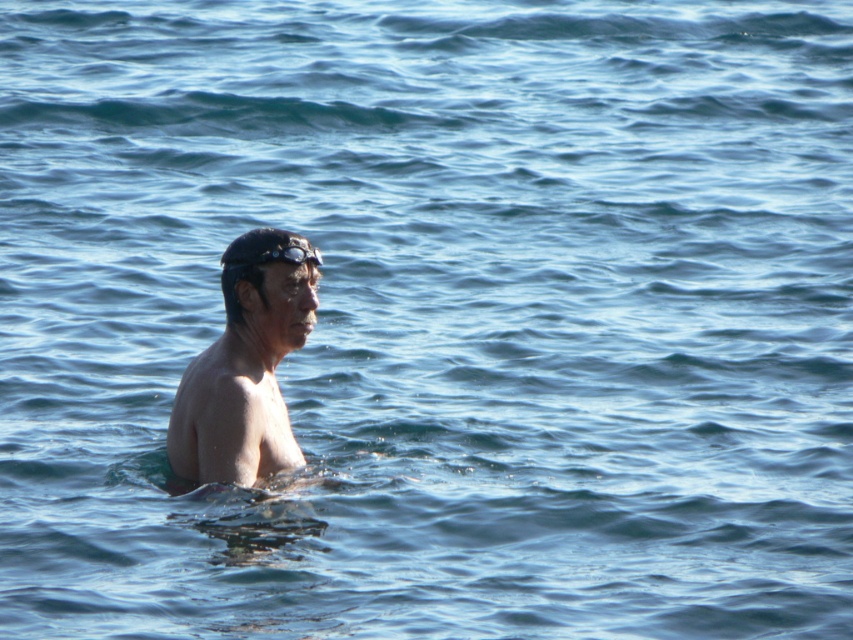
Does matte black swim cap at center have a greater height compared to black matte swim cap at center?

Yes.

Between point (212, 458) and point (294, 250), which one is positioned in front?

Point (212, 458) is more forward.

Does point (236, 336) lie in front of point (234, 275)?

No, (236, 336) is behind (234, 275).

Where is `matte black swim cap at center`? The height and width of the screenshot is (640, 853). matte black swim cap at center is located at coordinates (247, 365).

Is matte black swim cap at center above transparent rubber goggles at center?

Actually, matte black swim cap at center is below transparent rubber goggles at center.

Is point (177, 429) closer to camera compared to point (271, 250)?

No, (177, 429) is further to viewer.

This screenshot has width=853, height=640. Identify the location of matte black swim cap at center. (247, 365).

You are a GUI agent. You are given a task and a screenshot of the screen. Output one action in this format:
    pyautogui.click(x=<x>, y=<y>)
    Task: Click on the matte black swim cap at center
    
    Given the screenshot: What is the action you would take?
    pyautogui.click(x=247, y=365)

Is point (224, 305) closer to viewer compared to point (259, 260)?

That is False.

Between black matte swim cap at center and transparent rubber goggles at center, which one has less height?

transparent rubber goggles at center

Which is in front, point (292, 237) or point (294, 262)?

Point (292, 237) is in front.

Where is `black matte swim cap at center`? Image resolution: width=853 pixels, height=640 pixels. black matte swim cap at center is located at coordinates (259, 260).